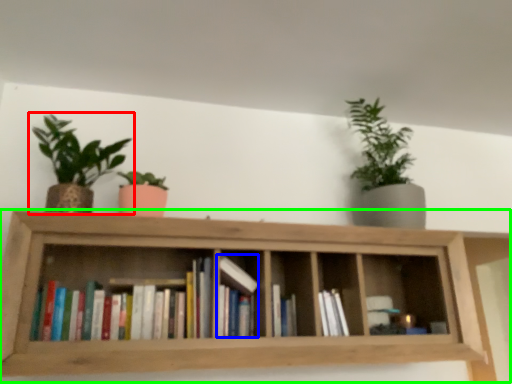
Question: Which is farther away from houseplant (highlighted by a red box)? book (highlighted by a blue box) or shelf (highlighted by a green box)?

Choices:
 (A) book
 (B) shelf

Answer: (A)